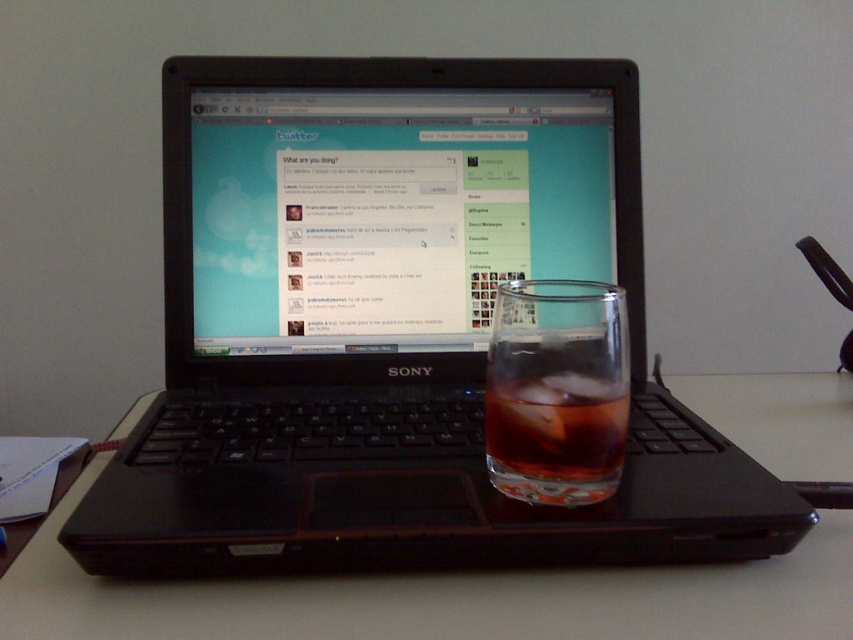
Is black plastic laptop at center below transparent glass at center?

Actually, black plastic laptop at center is above transparent glass at center.

Is point (428, 493) closer to camera compared to point (125, 589)?

No, (428, 493) is behind (125, 589).

This screenshot has height=640, width=853. What are the coordinates of `black plastic laptop at center` in the screenshot? It's located at (393, 326).

Does black plastic laptop at center lie behind translucent glass at laptop right?

That is False.

Describe the element at coordinates (393, 326) in the screenshot. I see `black plastic laptop at center` at that location.

Describe the element at coordinates (393, 326) in the screenshot. I see `black plastic laptop at center` at that location.

The width and height of the screenshot is (853, 640). Find the location of `black plastic laptop at center`. black plastic laptop at center is located at coordinates (393, 326).

Does transparent glass at center appear on the left side of translucent glass at laptop right?

No, transparent glass at center is not to the left of translucent glass at laptop right.

Image resolution: width=853 pixels, height=640 pixels. Describe the element at coordinates (439, 598) in the screenshot. I see `transparent glass at center` at that location.

Measure the distance between transparent glass at center and camera.

31.96 centimeters

Identify the location of transparent glass at center. (439, 598).